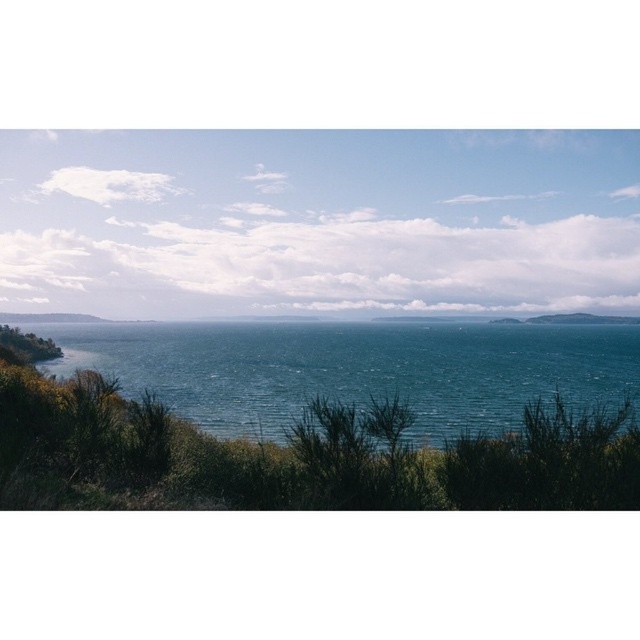
You are a photographer trying to capture the reflection of the distant hills on the water. Given that the teal glossy water at center and blue water at center are both present, which one is more likely to provide a clearer reflection?

The teal glossy water at center has a greater height compared to blue water at center, so it is more likely to provide a clearer reflection because its surface is calmer and smoother, allowing better reflection of the distant hills.

You are a drone operator planning to fly a drone between the teal glossy water at center and the blue water at center. The drone has a maximum flight distance of 500 feet. Can the drone safely make the trip without running out of battery?

The teal glossy water at center and blue water at center are 520.44 feet apart from each other. Since the drone can only fly up to 500 feet, it cannot safely make the trip without running out of battery.

You are a photographer trying to capture the reflection of the distant hills in the water. Which water area should you focus on, the teal glossy water at center or the blue water at center?

The teal glossy water at center is positioned under blue water at center, so the blue water at center is the surface where the reflection would be visible. Focus on the blue water at center.